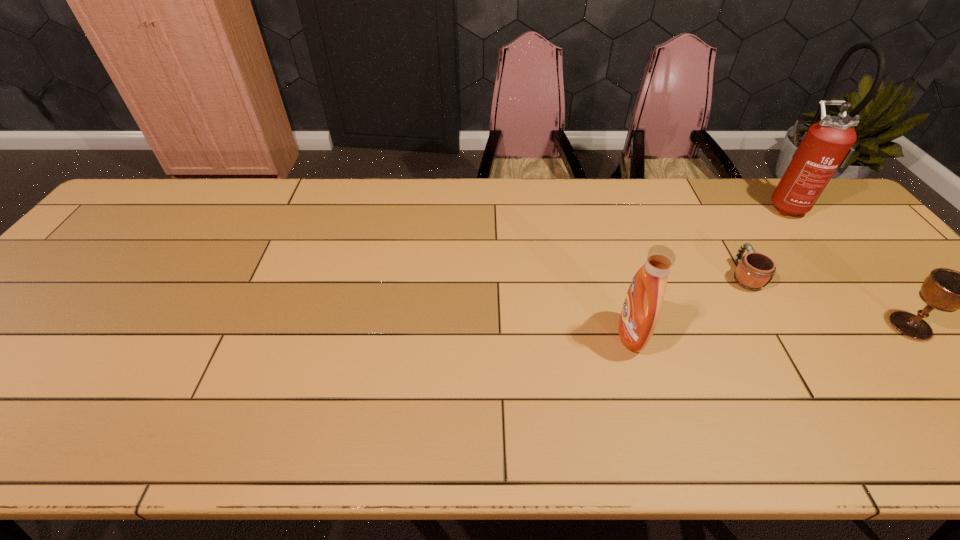
This screenshot has width=960, height=540. Find the location of `the tallest object`. the tallest object is located at coordinates (826, 145).

The width and height of the screenshot is (960, 540). In order to click on fire extinguisher in this screenshot , I will do (826, 145).

Find the location of a particular element. the leftmost object is located at coordinates (640, 313).

Locate an element on the screen. the third shortest object is located at coordinates (640, 313).

At what (x,y) coordinates should I click in order to perform the action: click on chalice. Please return your answer as a coordinate pair (x, y). This screenshot has width=960, height=540. Looking at the image, I should click on (947, 290).

You are a GUI agent. You are given a task and a screenshot of the screen. Output one action in this format:
    pyautogui.click(x=<x>, y=<y>)
    Task: Click on the second object from left to right
    The height and width of the screenshot is (540, 960).
    Given the screenshot: What is the action you would take?
    pyautogui.click(x=754, y=271)

The height and width of the screenshot is (540, 960). I want to click on the third nearest object, so click(x=754, y=271).

Find the location of `vacant region located 0.110m at the nozzle of the tallest object`. vacant region located 0.110m at the nozzle of the tallest object is located at coordinates (730, 204).

Locate an element on the screen. Image resolution: width=960 pixels, height=540 pixels. blank space located 0.300m at the nozzle of the tallest object is located at coordinates (670, 204).

At what (x,y) coordinates should I click in order to perform the action: click on vacant space located at the nozzle of the tallest object. Please return your answer as a coordinate pair (x, y). The width and height of the screenshot is (960, 540). Looking at the image, I should click on (666, 204).